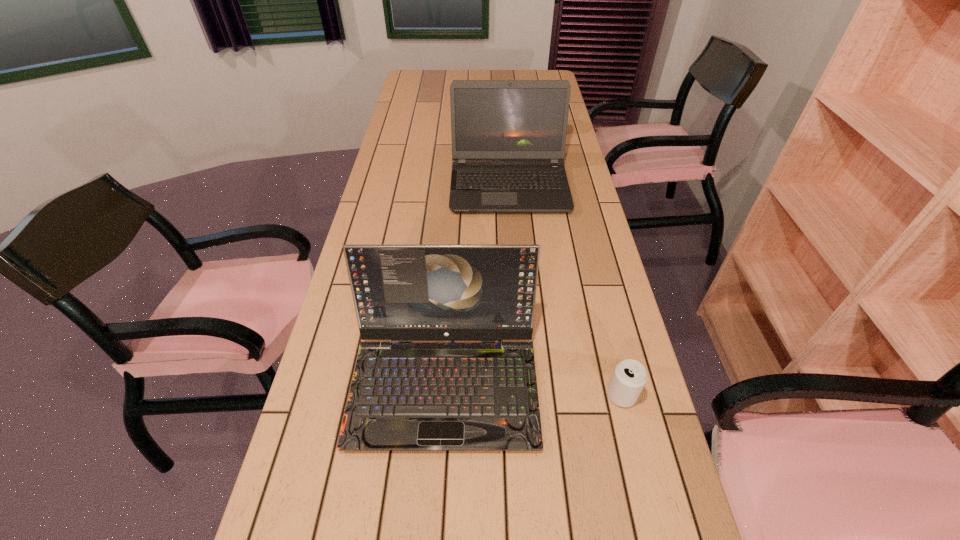
In the image, there is a desktop. Where is `vacant space at the left edge`? vacant space at the left edge is located at coordinates (381, 173).

This screenshot has height=540, width=960. In order to click on vacant space at the right edge of the desktop in this screenshot , I will do `click(617, 409)`.

This screenshot has width=960, height=540. In the image, there is a desktop. In order to click on vacant space at the far left corner in this screenshot , I will do `click(408, 70)`.

Locate an element on the screen. The height and width of the screenshot is (540, 960). free space between the shortest object and the farther laptop computer is located at coordinates pos(565,291).

Image resolution: width=960 pixels, height=540 pixels. I want to click on vacant area between the farther laptop computer and the can, so pos(565,291).

Point out which object is positioned as the second nearest to the can. Please provide its 2D coordinates. Your answer should be formatted as a tuple, i.e. [(x, y)], where the tuple contains the x and y coordinates of a point satisfying the conditions above.

[(512, 133)]

You are a GUI agent. You are given a task and a screenshot of the screen. Output one action in this format:
    pyautogui.click(x=<x>, y=<y>)
    Task: Click on the closest object relative to the nearer laptop computer
    Image resolution: width=960 pixels, height=540 pixels.
    Given the screenshot: What is the action you would take?
    pyautogui.click(x=629, y=377)

The height and width of the screenshot is (540, 960). What are the coordinates of `blank space that satisfies the following two spatial constraints: 1. on the screen of the nearer laptop computer; 2. on the right side of the shortest object` in the screenshot? It's located at (444, 395).

Locate an element on the screen. Image resolution: width=960 pixels, height=540 pixels. free point that satisfies the following two spatial constraints: 1. on the screen of the farther laptop computer; 2. on the right side of the can is located at coordinates (526, 395).

At what (x,y) coordinates should I click in order to perform the action: click on vacant area in the image that satisfies the following two spatial constraints: 1. on the screen of the shortest object; 2. on the left side of the nearer laptop computer. Please return your answer as a coordinate pair (x, y). Looking at the image, I should click on (444, 395).